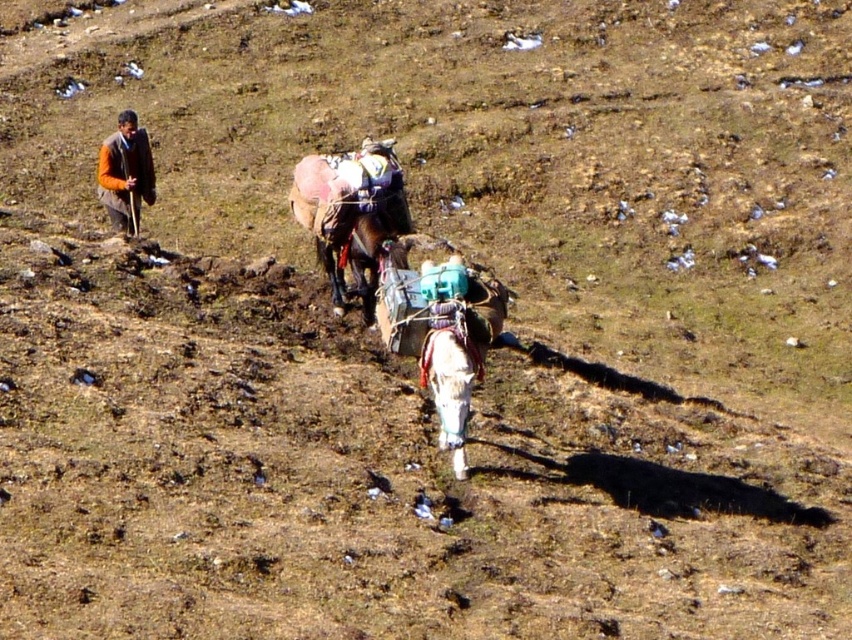
You are a traveler who needs to secure a white woolen blanket at center against the rain. The brown leather mule at center is nearby. Where should you place the blanket relative to the mule to keep it dry if rain starts?

The brown leather mule at center is positioned on the left side of white woolen blanket at center. To keep the blanket dry, place it under the mule where it is sheltered from the rain.